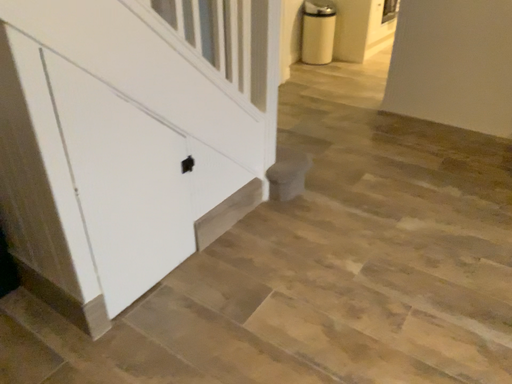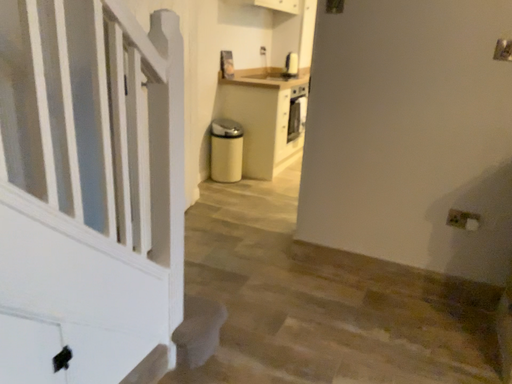
Question: How did the camera likely rotate when shooting the video?

Choices:
 (A) rotated upward
 (B) rotated downward

Answer: (A)